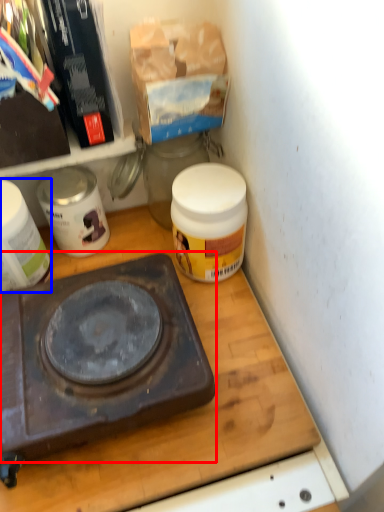
Question: Which object appears farthest to the camera in this image, gas stove (highlighted by a red box) or appliance (highlighted by a blue box)?

Choices:
 (A) gas stove
 (B) appliance

Answer: (B)